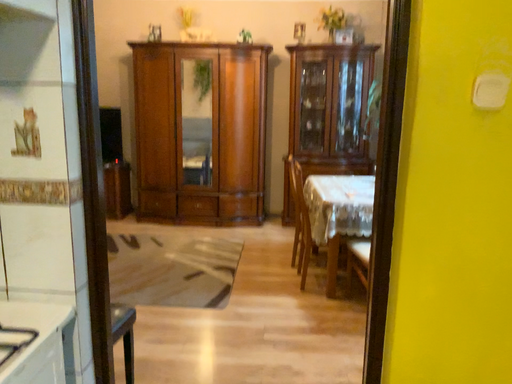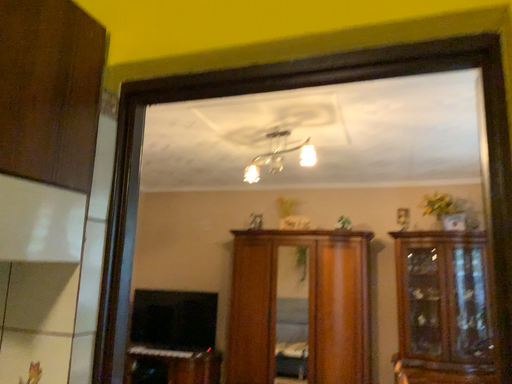
Question: How did the camera likely rotate when shooting the video?

Choices:
 (A) rotated right
 (B) rotated left

Answer: (B)